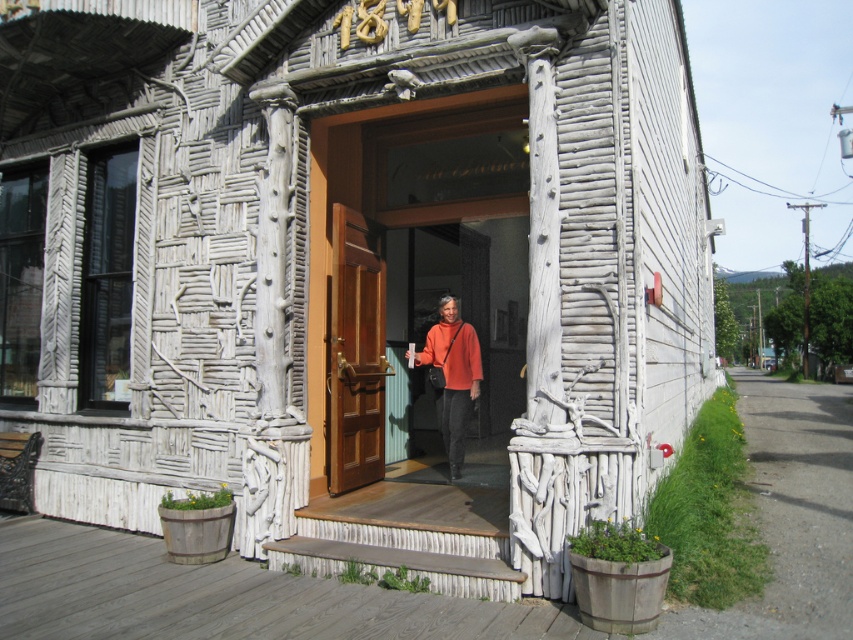
Question: Which object appears closest to the camera in this image?

Choices:
 (A) orange sweater at center
 (B) brown wooden door at center

Answer: (B)

Question: From the image, what is the correct spatial relationship of brown wooden door at center in relation to orange sweater at center?

Choices:
 (A) right
 (B) left

Answer: (B)

Question: Does brown wooden door at center have a lesser width compared to orange sweater at center?

Choices:
 (A) yes
 (B) no

Answer: (A)

Question: Does brown wooden door at center appear on the right side of orange sweater at center?

Choices:
 (A) no
 (B) yes

Answer: (A)

Question: Which object appears farthest from the camera in this image?

Choices:
 (A) orange sweater at center
 (B) brown wooden door at center

Answer: (A)

Question: Which point is farther to the camera?

Choices:
 (A) orange sweater at center
 (B) brown wooden door at center

Answer: (A)